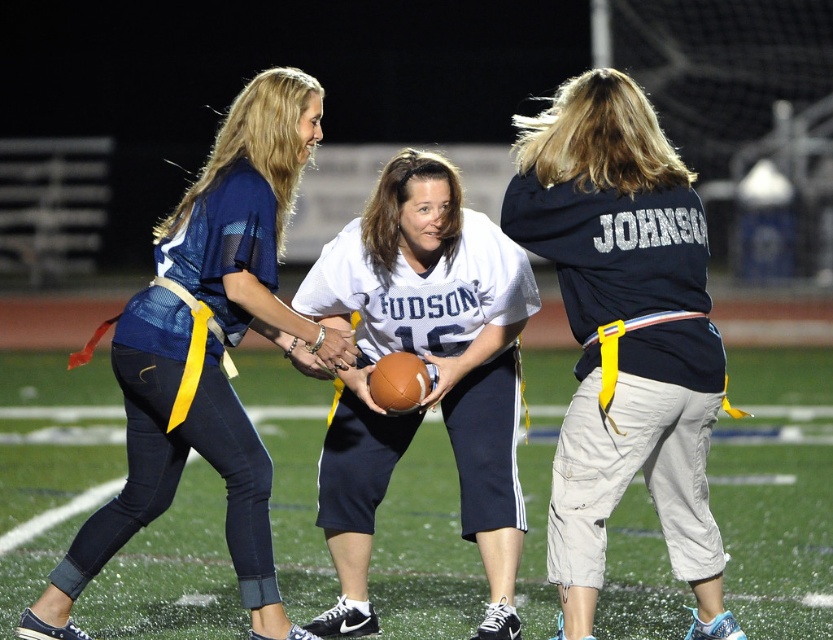
Is green artificial turf at center further to camera compared to navy blue jersey at center?

Yes, it is.

Between green artificial turf at center and navy blue jersey at center, which one appears on the left side from the viewer's perspective?

green artificial turf at center is more to the left.

The width and height of the screenshot is (833, 640). What do you see at coordinates (774, 524) in the screenshot? I see `green artificial turf at center` at bounding box center [774, 524].

At what (x,y) coordinates should I click in order to perform the action: click on green artificial turf at center. Please return your answer as a coordinate pair (x, y). Looking at the image, I should click on (774, 524).

Is point (233, 296) positioned after point (397, 157)?

No, it is in front of (397, 157).

Which is in front, point (161, 438) or point (490, 380)?

Point (161, 438) is in front.

Is point (143, 317) farther from camera compared to point (412, 339)?

No, (143, 317) is closer to viewer.

Identify the location of matte blue jersey at center. (208, 352).

Which is more to the right, green artificial turf at center or matte blue jersey at center?

From the viewer's perspective, green artificial turf at center appears more on the right side.

Which is behind, point (30, 577) or point (158, 481)?

Point (30, 577)

Is point (237, 604) in front of point (133, 422)?

No.

Image resolution: width=833 pixels, height=640 pixels. Find the location of `green artificial turf at center`. green artificial turf at center is located at coordinates (774, 524).